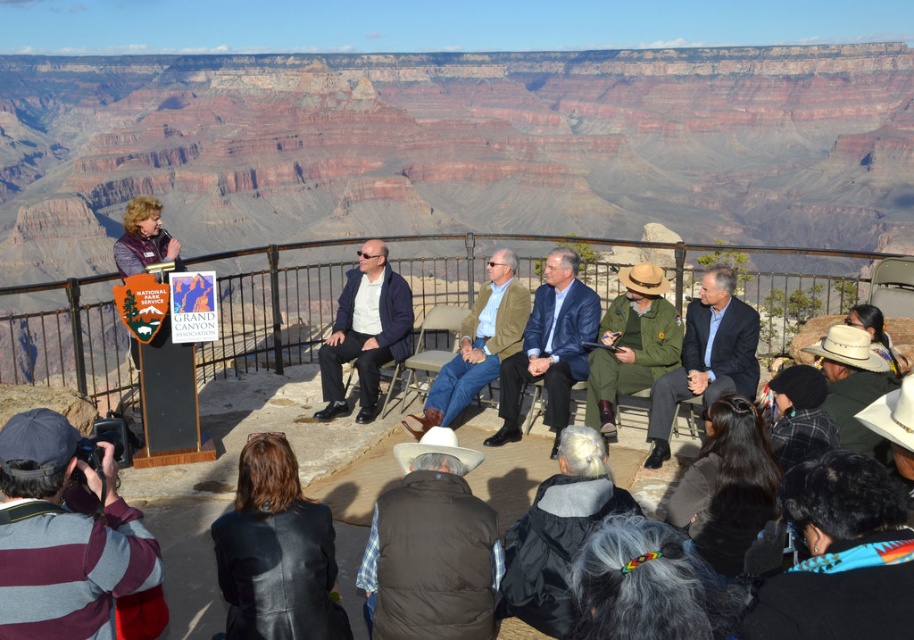
You are a photographer at the Grand Canyon scene. You need to place your striped fabric camera at lower left and matte green uniform at center in your backpack. Which item will take up more space in your backpack?

The matte green uniform at center takes up more space in the backpack than the striped fabric camera at lower left because the striped fabric camera at lower left occupies less space than matte green uniform at center.

You are standing at the edge of the Grand Canyon and see the National Park Service podium with a woman speaking. Where is the matte green uniform at center located relative to the podium?

The matte green uniform at center is located at the coordinates point [707,356] in the image.

You are a photographer standing at the edge of the Grand Canyon. You notice two people in the scene, one wearing a brown puffy vest at lower center and another in a matte green uniform at center. Which person appears shorter in the photo?

The brown puffy vest at lower center is not as tall as the matte green uniform at center, so the person in the brown puffy vest at lower center appears shorter.